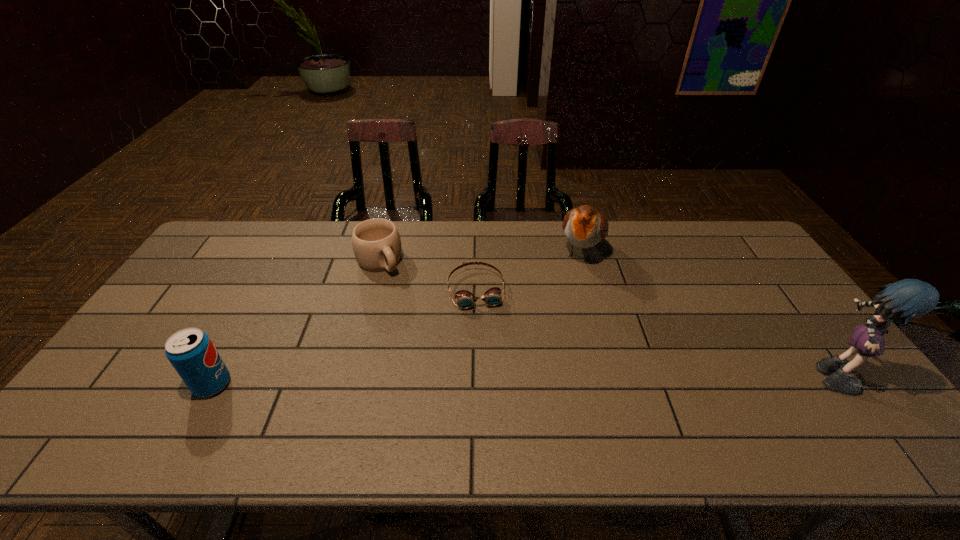
The width and height of the screenshot is (960, 540). Find the location of `the third tallest object`. the third tallest object is located at coordinates (191, 352).

The image size is (960, 540). Identify the location of the leftmost object. (191, 352).

You are a GUI agent. You are given a task and a screenshot of the screen. Output one action in this format:
    pyautogui.click(x=<x>, y=<y>)
    Task: Click on the rag doll
    The height and width of the screenshot is (540, 960).
    Given the screenshot: What is the action you would take?
    pyautogui.click(x=908, y=299)

I want to click on the rightmost object, so click(908, 299).

This screenshot has width=960, height=540. What are the coordinates of `the fourth object from right to left` in the screenshot? It's located at (376, 242).

Find the location of a particular element. This screenshot has width=960, height=540. mug is located at coordinates (376, 242).

The height and width of the screenshot is (540, 960). Identify the location of the second tallest object. (x=584, y=227).

The image size is (960, 540). I want to click on the second object from right to left, so click(584, 227).

Identify the location of goggles. (465, 299).

At what (x,y) coordinates should I click in order to perform the action: click on the third object from left to right. Please return your answer as a coordinate pair (x, y). Looking at the image, I should click on (465, 299).